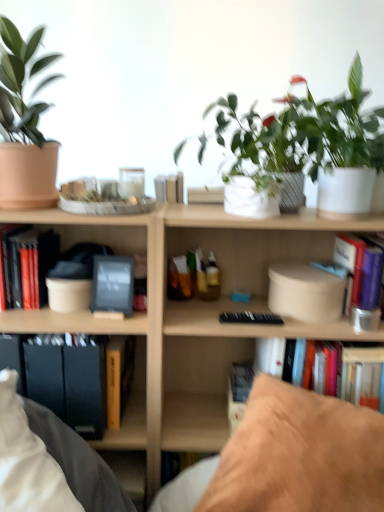
Question: Is hardcover book at lower left, the second paperback book from the left, not within hardcover book at left, the first book from the left?

Choices:
 (A) yes
 (B) no

Answer: (A)

Question: Considering the relative sizes of hardcover book at lower left, the second paperback book from the left, and hardcover book at left, the first book from the left, in the image provided, is hardcover book at lower left, the second paperback book from the left, wider than hardcover book at left, the first book from the left,?

Choices:
 (A) no
 (B) yes

Answer: (A)

Question: Is hardcover book at lower left, the second paperback book from the left, at the left side of hardcover book at left, the first book from the left?

Choices:
 (A) yes
 (B) no

Answer: (B)

Question: From a real-world perspective, is hardcover book at lower left, the second paperback book from the left, positioned under hardcover book at left, the first book from the left, based on gravity?

Choices:
 (A) yes
 (B) no

Answer: (A)

Question: Is the position of hardcover book at lower left, the second paperback book from the left, more distant than that of hardcover book at left, the first book from the left?

Choices:
 (A) yes
 (B) no

Answer: (B)

Question: Is hardcover book at lower left, which ranks as the 2th paperback book in right-to-left order, to the right of hardcover book at left, the first book from the left, from the viewer's perspective?

Choices:
 (A) no
 (B) yes

Answer: (B)

Question: From the image's perspective, is hardcover book at left, the second book viewed from the right, located beneath brown suede pillow at lower right?

Choices:
 (A) yes
 (B) no

Answer: (B)

Question: Is hardcover book at left, the second book viewed from the right, taller than brown suede pillow at lower right?

Choices:
 (A) no
 (B) yes

Answer: (A)

Question: Is brown suede pillow at lower right at the back of hardcover book at left, the first book from the left?

Choices:
 (A) yes
 (B) no

Answer: (B)

Question: Does hardcover book at left, the first book from the left, have a greater width compared to brown suede pillow at lower right?

Choices:
 (A) no
 (B) yes

Answer: (A)

Question: Is hardcover book at left, the first book from the left, at the left side of brown suede pillow at lower right?

Choices:
 (A) no
 (B) yes

Answer: (B)

Question: From a real-world perspective, is hardcover book at left, the second book viewed from the right, on brown suede pillow at lower right?

Choices:
 (A) yes
 (B) no

Answer: (A)

Question: Does green matte plant at upper right, the 2th houseplant when ordered from left to right, have a lesser height compared to white matte flowerpot at center?

Choices:
 (A) no
 (B) yes

Answer: (A)